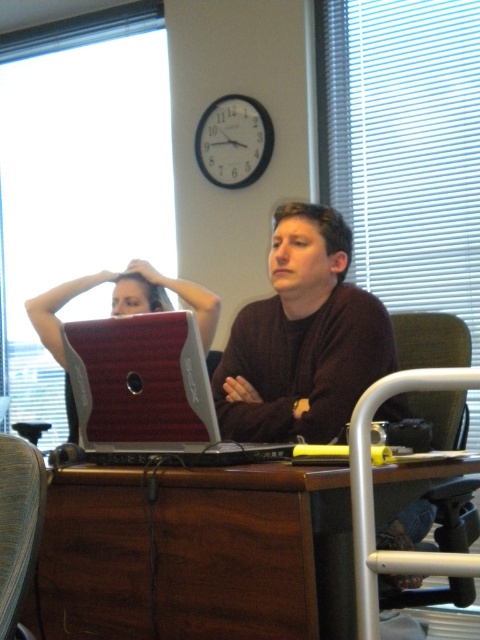
Question: Considering the relative positions of metallic silver laptop at center and matte brown hair at center in the image provided, where is metallic silver laptop at center located with respect to matte brown hair at center?

Choices:
 (A) left
 (B) right

Answer: (A)

Question: From the image, what is the correct spatial relationship of brown wood desk at center in relation to matte brown hair at center?

Choices:
 (A) above
 (B) below

Answer: (B)

Question: Among these points, which one is nearest to the camera?

Choices:
 (A) (360, 388)
 (B) (24, 550)
 (C) (146, 556)
 (D) (311, 225)

Answer: (B)

Question: Which point appears closest to the camera in this image?

Choices:
 (A) (84, 291)
 (B) (324, 228)
 (C) (4, 595)

Answer: (C)

Question: Which of the following is the closest to the observer?

Choices:
 (A) (31, 452)
 (B) (128, 292)
 (C) (282, 250)

Answer: (A)

Question: Does brown matte sweater at center have a larger size compared to metallic silver laptop at center?

Choices:
 (A) yes
 (B) no

Answer: (B)